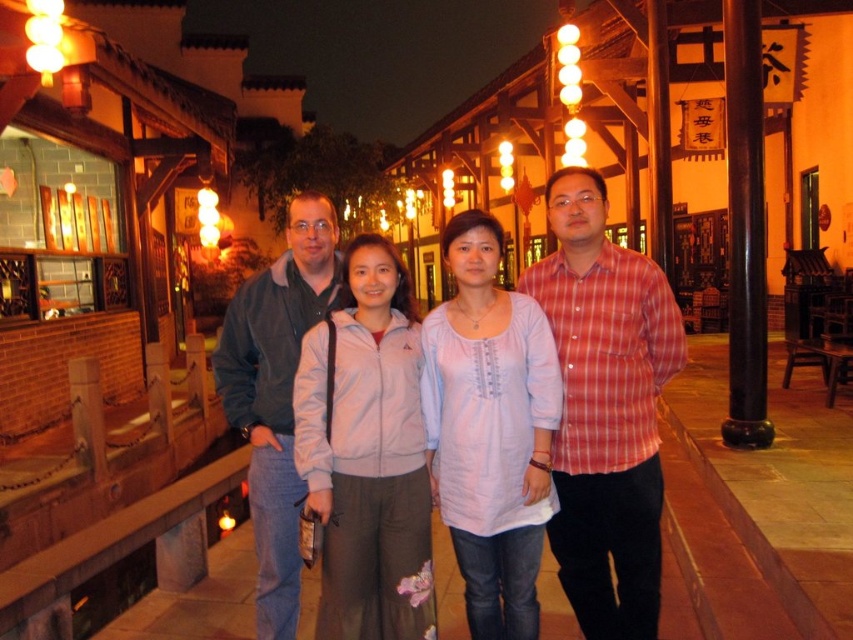
Looking at this image, you are standing at the entrance of the traditional Chinese street and see the group of people. There is a point marked at coordinates point (605,408). Which person in the group is wearing a red plaid shirt at center?

The red plaid shirt at center is represented by point (605,408), so the person wearing the red plaid shirt at center is located at that coordinate.

You are standing in front of the traditional Chinese street scene with four people. There are two points marked in the image. One is at coordinate point (397,298) and the other is at coordinate point (299,221). Which of these two points is closer to you?

Point (397,298) is closer to the viewer than point (299,221).